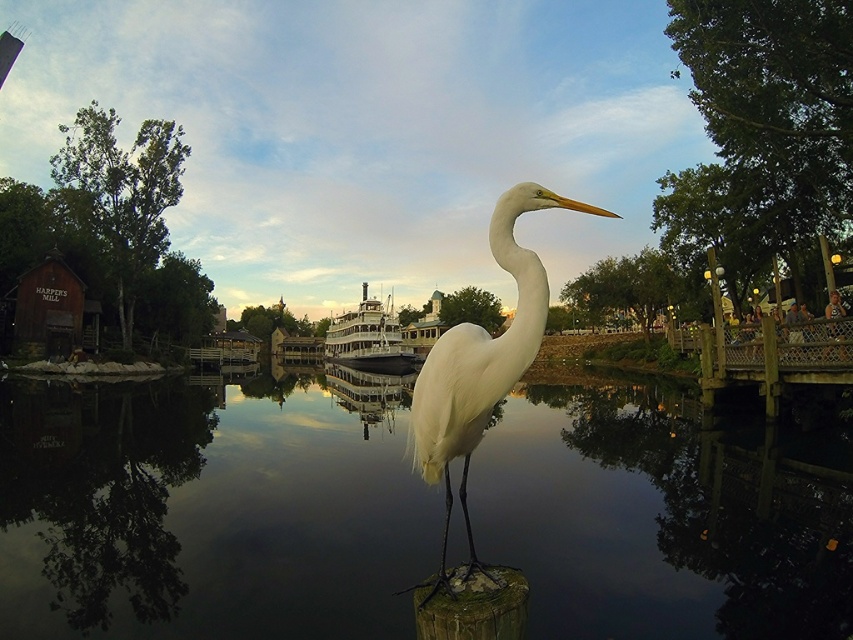
Where is `transparent water at center`? The width and height of the screenshot is (853, 640). transparent water at center is located at coordinates (209, 512).

Between point (820, 525) and point (403, 352), which one is positioned in front?

Point (820, 525) is more forward.

Between point (416, 515) and point (357, 358), which one is positioned in front?

Positioned in front is point (416, 515).

The image size is (853, 640). Identify the location of transparent water at center. (209, 512).

Can you confirm if white feathered bird at center is smaller than polished wood boat at center?

Indeed, white feathered bird at center has a smaller size compared to polished wood boat at center.

Is white feathered bird at center behind polished wood boat at center?

No, white feathered bird at center is closer to the viewer.

Identify the location of white feathered bird at center. (480, 365).

Find the location of a particular element. The height and width of the screenshot is (640, 853). white feathered bird at center is located at coordinates (480, 365).

Does transparent water at center appear over white feathered bird at center?

No.

Is transparent water at center below white feathered bird at center?

Yes.

Describe the element at coordinates (209, 512) in the screenshot. I see `transparent water at center` at that location.

The image size is (853, 640). What are the coordinates of `transparent water at center` in the screenshot? It's located at (209, 512).